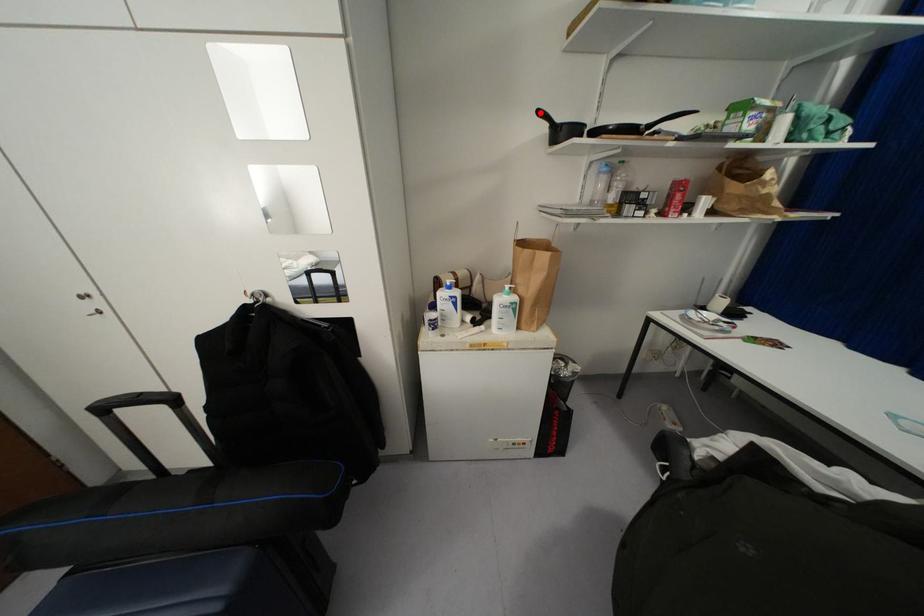
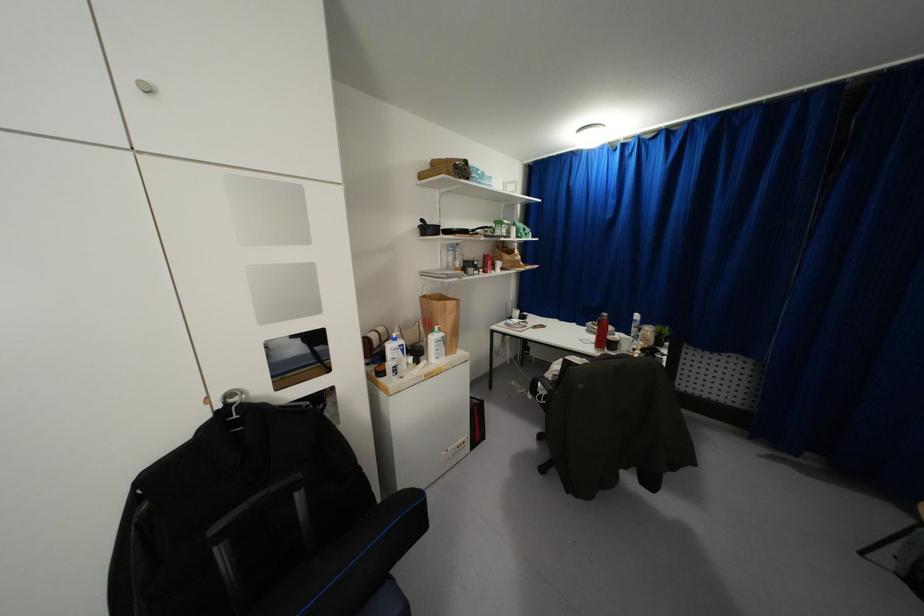
Find the pixel in the second image that matches the highlighted location in the first image.

(421, 220)